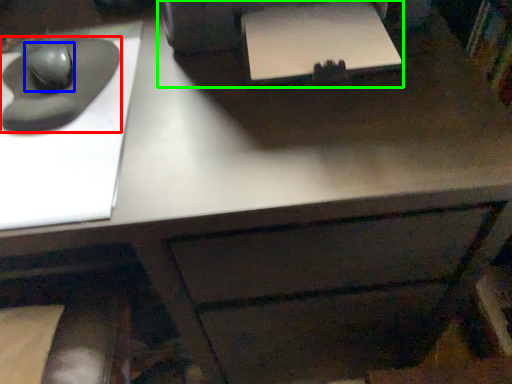
Question: Considering the real-world distances, which object is closest to mouse (highlighted by a red box)? mouse (highlighted by a blue box) or printer (highlighted by a green box).

Choices:
 (A) mouse
 (B) printer

Answer: (A)